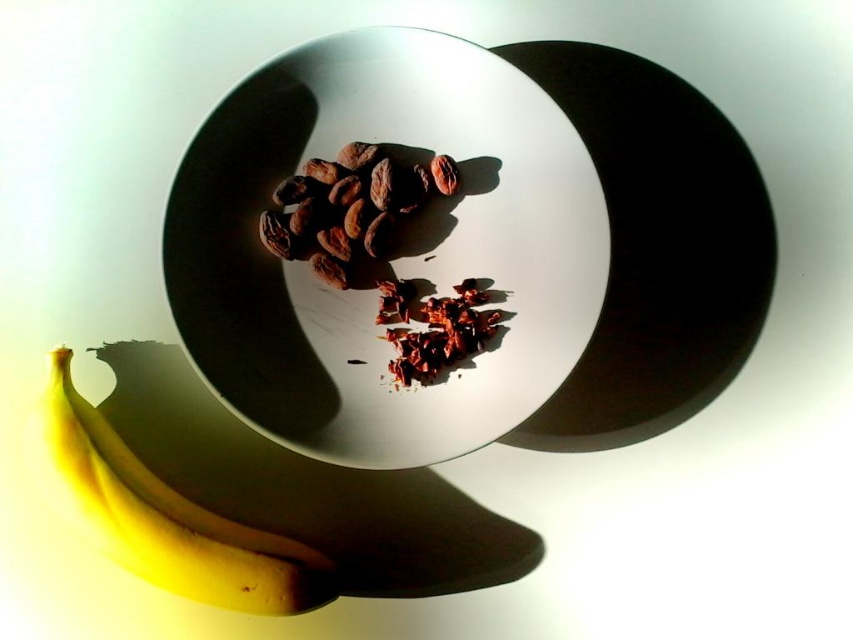
Is point (228, 256) farther from viewer compared to point (352, 209)?

No, it is in front of (352, 209).

Which of these two, white glossy plate at center or brown matte chocolate at center, stands taller?

Standing taller between the two is white glossy plate at center.

Describe the element at coordinates (397, 250) in the screenshot. I see `white glossy plate at center` at that location.

Find the location of a particular element. The image size is (853, 640). white glossy plate at center is located at coordinates (397, 250).

Can you confirm if yellow matte bananas at lower left is positioned to the left of brown matte chocolate at center?

Indeed, yellow matte bananas at lower left is positioned on the left side of brown matte chocolate at center.

Based on the photo, is yellow matte bananas at lower left shorter than brown matte chocolate at center?

In fact, yellow matte bananas at lower left may be taller than brown matte chocolate at center.

Does point (223, 596) lie in front of point (370, 205)?

Yes, it is.

Find the location of a particular element. yellow matte bananas at lower left is located at coordinates (172, 518).

Between yellow matte bananas at lower left and dark red crumbly chocolate at center, which one is positioned higher?

Positioned higher is dark red crumbly chocolate at center.

Does yellow matte bananas at lower left have a greater height compared to dark red crumbly chocolate at center?

Correct, yellow matte bananas at lower left is much taller as dark red crumbly chocolate at center.

Which is behind, point (149, 564) or point (431, 353)?

Positioned behind is point (431, 353).

Locate an element on the screen. yellow matte bananas at lower left is located at coordinates (172, 518).